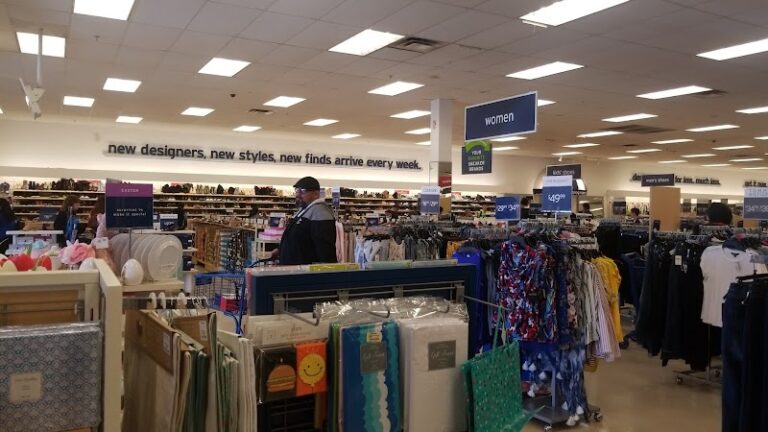
Find the location of a particular element. Image resolution: width=768 pixels, height=432 pixels. light is located at coordinates (564, 68).